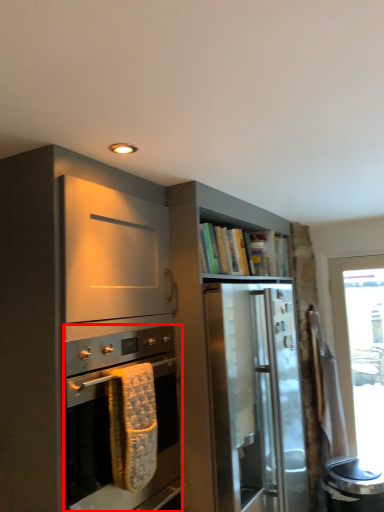
Question: Considering the relative positions of oven (annotated by the red box) and cabinetry in the image provided, where is oven (annotated by the red box) located with respect to the staircase?

Choices:
 (A) left
 (B) right

Answer: (A)